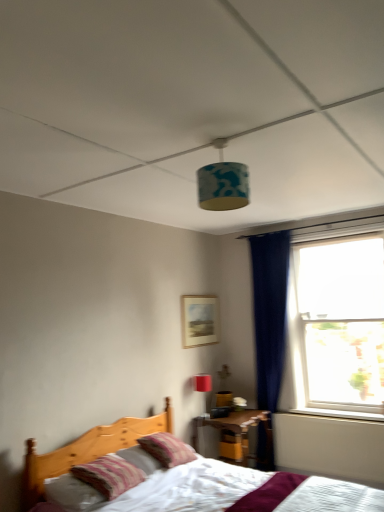
Locate an element on the screen. This screenshot has height=512, width=384. blue fabric lampshade at center is located at coordinates (223, 183).

What are the coordinates of `matte wooden picture frame at center` in the screenshot? It's located at (199, 320).

At what (x,y) coordinates should I click in order to perform the action: click on striped fabric pillow at center, placed as the second pillow when sorted from front to back. Please return your answer as a coordinate pair (x, y). Looking at the image, I should click on (167, 449).

What is the approximate width of transparent glass window at right?

transparent glass window at right is 30.23 centimeters wide.

Where is `transparent glass window at right`? This screenshot has width=384, height=512. transparent glass window at right is located at coordinates click(332, 311).

Locate an element on the screen. wooden nightstand at lower center is located at coordinates (235, 424).

Considering the sizes of matte wooden picture frame at center and striped fabric pillow at center, arranged as the 1th pillow when viewed from the back, in the image, is matte wooden picture frame at center bigger or smaller than striped fabric pillow at center, arranged as the 1th pillow when viewed from the back,?

matte wooden picture frame at center is smaller than striped fabric pillow at center, arranged as the 1th pillow when viewed from the back.

Could you tell me if matte wooden picture frame at center is turned towards striped fabric pillow at center, arranged as the 1th pillow when viewed from the back?

No, matte wooden picture frame at center is not facing towards striped fabric pillow at center, arranged as the 1th pillow when viewed from the back.

Would you say matte wooden picture frame at center contains striped fabric pillow at center, placed as the second pillow when sorted from front to back?

Definitely not — striped fabric pillow at center, placed as the second pillow when sorted from front to back, is not inside matte wooden picture frame at center.

Would you consider matte wooden picture frame at center to be distant from striped fabric pillow at center, placed as the second pillow when sorted from front to back?

matte wooden picture frame at center is far away from striped fabric pillow at center, placed as the second pillow when sorted from front to back.

Is matte red table lamp at upper center taller than striped fabric pillow at center, arranged as the 1th pillow when viewed from the back?

Yes, matte red table lamp at upper center is taller than striped fabric pillow at center, arranged as the 1th pillow when viewed from the back.

In the scene shown: Does matte red table lamp at upper center turn towards striped fabric pillow at center, placed as the second pillow when sorted from front to back?

No, matte red table lamp at upper center does not turn towards striped fabric pillow at center, placed as the second pillow when sorted from front to back.

Could you measure the distance between matte red table lamp at upper center and striped fabric pillow at center, arranged as the 1th pillow when viewed from the back?

matte red table lamp at upper center and striped fabric pillow at center, arranged as the 1th pillow when viewed from the back, are 3.50 feet apart.

Is matte red table lamp at upper center not near striped fabric pillow at center, placed as the second pillow when sorted from front to back?

Indeed, matte red table lamp at upper center is not near striped fabric pillow at center, placed as the second pillow when sorted from front to back.

Considering the relative sizes of wooden nightstand at lower center and transparent glass window at right in the image provided, is wooden nightstand at lower center wider than transparent glass window at right?

Yes.

Is wooden nightstand at lower center facing towards transparent glass window at right?

No, wooden nightstand at lower center is not aimed at transparent glass window at right.

From a real-world perspective, is wooden nightstand at lower center located beneath transparent glass window at right?

Yes, from a real-world perspective, wooden nightstand at lower center is beneath transparent glass window at right.

Would you say wooden nightstand at lower center is outside transparent glass window at right?

wooden nightstand at lower center lies outside transparent glass window at right's area.

From the matte red table lamp at upper center, count the 2nd pillow to the left and point to it. Please provide its 2D coordinates.

[(109, 475)]

Based on their positions, is matte red table lamp at upper center located to the left or right of striped fabric pillow at lower left, acting as the 1th pillow starting from the front?

matte red table lamp at upper center is to the right of striped fabric pillow at lower left, acting as the 1th pillow starting from the front.

Considering the relative sizes of matte red table lamp at upper center and striped fabric pillow at lower left, acting as the 1th pillow starting from the front, in the image provided, is matte red table lamp at upper center bigger than striped fabric pillow at lower left, acting as the 1th pillow starting from the front,?

No, matte red table lamp at upper center is not bigger than striped fabric pillow at lower left, acting as the 1th pillow starting from the front.

In the scene shown: From a real-world perspective, between matte red table lamp at upper center and striped fabric pillow at lower left, acting as the 1th pillow starting from the front, who is vertically higher?

matte red table lamp at upper center.

Is wooden nightstand at lower center located within white plastic window sill at lower right?

That's incorrect, wooden nightstand at lower center is not inside white plastic window sill at lower right.

I want to click on nightstand below the white plastic window sill at lower right (from the image's perspective), so click(x=235, y=424).

From a real-world perspective, is white plastic window sill at lower right over wooden nightstand at lower center?

Yes.

Does white plastic window sill at lower right turn towards wooden nightstand at lower center?

No, white plastic window sill at lower right is not aimed at wooden nightstand at lower center.

Between striped fabric pillow at lower left, acting as the 1th pillow starting from the front, and wooden nightstand at lower center, which one has less height?

striped fabric pillow at lower left, acting as the 1th pillow starting from the front.

From a real-world perspective, between striped fabric pillow at lower left, acting as the 1th pillow starting from the front, and wooden nightstand at lower center, who is vertically higher?

striped fabric pillow at lower left, acting as the 1th pillow starting from the front.

How different are the orientations of striped fabric pillow at center, arranged as the 1th pillow when viewed from the back, and transparent glass window at right in degrees?

There is a 88.9-degree angle between the facing directions of striped fabric pillow at center, arranged as the 1th pillow when viewed from the back, and transparent glass window at right.

Is transparent glass window at right at the back of striped fabric pillow at center, placed as the second pillow when sorted from front to back?

striped fabric pillow at center, placed as the second pillow when sorted from front to back, does not have its back to transparent glass window at right.

Considering the relative positions of striped fabric pillow at center, arranged as the 1th pillow when viewed from the back, and transparent glass window at right in the image provided, is striped fabric pillow at center, arranged as the 1th pillow when viewed from the back, to the right of transparent glass window at right from the viewer's perspective?

No, striped fabric pillow at center, arranged as the 1th pillow when viewed from the back, is not to the right of transparent glass window at right.

Is transparent glass window at right completely or partially inside striped fabric pillow at center, arranged as the 1th pillow when viewed from the back?

That's incorrect, transparent glass window at right is not inside striped fabric pillow at center, arranged as the 1th pillow when viewed from the back.

Locate an element on the screen. This screenshot has width=384, height=512. picture frame lying above the striped fabric pillow at center, arranged as the 1th pillow when viewed from the back (from the image's perspective) is located at coordinates (199, 320).

You are a GUI agent. You are given a task and a screenshot of the screen. Output one action in this format:
    pyautogui.click(x=<x>, y=<y>)
    Task: Click on the table lamp on the right of the striped fabric pillow at center, placed as the second pillow when sorted from front to back
    The image size is (384, 512).
    Given the screenshot: What is the action you would take?
    pyautogui.click(x=203, y=383)

Based on their spatial positions, is matte red table lamp at upper center or matte wooden picture frame at center closer to striped fabric pillow at center, arranged as the 1th pillow when viewed from the back?

matte red table lamp at upper center lies closer to striped fabric pillow at center, arranged as the 1th pillow when viewed from the back, than the other object.

From the picture: From the image, which object appears to be nearer to white plastic window sill at lower right, matte wooden picture frame at center or blue fabric lampshade at center?

matte wooden picture frame at center is positioned closer to the anchor white plastic window sill at lower right.

Considering their positions, is matte wooden picture frame at center positioned closer to striped fabric pillow at lower left, acting as the 1th pillow starting from the front, than transparent glass window at right?

matte wooden picture frame at center is positioned closer to the anchor striped fabric pillow at lower left, acting as the 1th pillow starting from the front.

Which object lies further to the anchor point matte wooden picture frame at center, striped fabric pillow at center, placed as the second pillow when sorted from front to back, or transparent glass window at right?

striped fabric pillow at center, placed as the second pillow when sorted from front to back, is further to matte wooden picture frame at center.

Looking at the image, which one is located closer to matte red table lamp at upper center, striped fabric pillow at lower left, placed as the 2th pillow when sorted from back to front, or white plastic window sill at lower right?

Among the two, white plastic window sill at lower right is located nearer to matte red table lamp at upper center.

Which object lies further to the anchor point wooden nightstand at lower center, blue fabric lampshade at center or matte red table lamp at upper center?

The object further to wooden nightstand at lower center is blue fabric lampshade at center.

Which object lies further to the anchor point blue fabric lampshade at center, striped fabric pillow at lower left, acting as the 1th pillow starting from the front, or striped fabric pillow at center, arranged as the 1th pillow when viewed from the back?

striped fabric pillow at center, arranged as the 1th pillow when viewed from the back, is further to blue fabric lampshade at center.

Based on their spatial positions, is blue fabric lampshade at center or wooden nightstand at lower center further from striped fabric pillow at center, placed as the second pillow when sorted from front to back?

Based on the image, blue fabric lampshade at center appears to be further to striped fabric pillow at center, placed as the second pillow when sorted from front to back.

The image size is (384, 512). In order to click on picture frame located between matte red table lamp at upper center and transparent glass window at right in the left-right direction in this screenshot , I will do `click(199, 320)`.

The image size is (384, 512). Find the location of `window sill between striped fabric pillow at lower left, acting as the 1th pillow starting from the front, and transparent glass window at right`. window sill between striped fabric pillow at lower left, acting as the 1th pillow starting from the front, and transparent glass window at right is located at coordinates (337, 414).

Where is `window between blue fabric lampshade at center and striped fabric pillow at center, placed as the second pillow when sorted from front to back, in the up-down direction`? The image size is (384, 512). window between blue fabric lampshade at center and striped fabric pillow at center, placed as the second pillow when sorted from front to back, in the up-down direction is located at coordinates (332, 311).

Where is `picture frame between striped fabric pillow at lower left, placed as the 2th pillow when sorted from back to front, and white plastic window sill at lower right`? The image size is (384, 512). picture frame between striped fabric pillow at lower left, placed as the 2th pillow when sorted from back to front, and white plastic window sill at lower right is located at coordinates (199, 320).